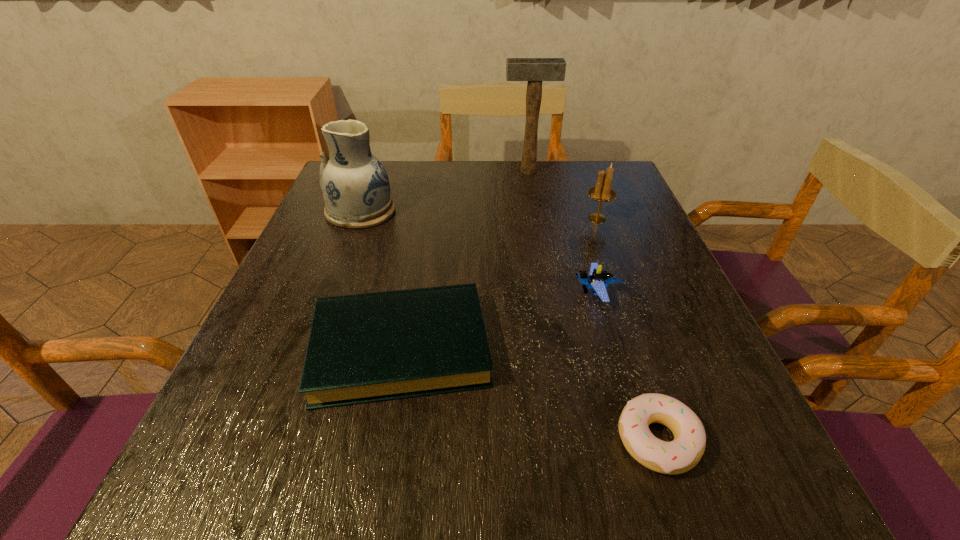
Find the location of a particular element. The height and width of the screenshot is (540, 960). the tallest object is located at coordinates (534, 70).

At what (x,y) coordinates should I click in order to perform the action: click on mallet. Please return your answer as a coordinate pair (x, y). This screenshot has width=960, height=540. Looking at the image, I should click on (534, 70).

Identify the location of pottery. The image size is (960, 540). (356, 190).

The height and width of the screenshot is (540, 960). In order to click on the third tallest object in this screenshot , I will do coord(602,192).

The width and height of the screenshot is (960, 540). What are the coordinates of `the fourth tallest object` in the screenshot? It's located at (598, 279).

Find the location of `book`. book is located at coordinates (369, 347).

You are a GUI agent. You are given a task and a screenshot of the screen. Output one action in this format:
    pyautogui.click(x=<x>, y=<y>)
    Task: Click on the doughnut
    This screenshot has width=960, height=540.
    Given the screenshot: What is the action you would take?
    pyautogui.click(x=683, y=453)

Locate an element on the screen. The height and width of the screenshot is (540, 960). free space located 0.180m on the right of the farthest object is located at coordinates (614, 171).

This screenshot has width=960, height=540. In order to click on vacant area situated on the front of the second tallest object in this screenshot , I will do `click(306, 355)`.

Locate an element on the screen. This screenshot has height=540, width=960. free location located on the left of the candle holder is located at coordinates (459, 219).